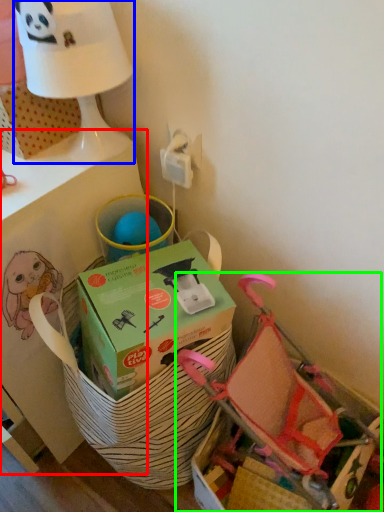
Question: Based on their relative distances, which object is nearer to table (highlighted by a red box)? Choose from table lamp (highlighted by a blue box) and baby carriage (highlighted by a green box).

Choices:
 (A) table lamp
 (B) baby carriage

Answer: (A)